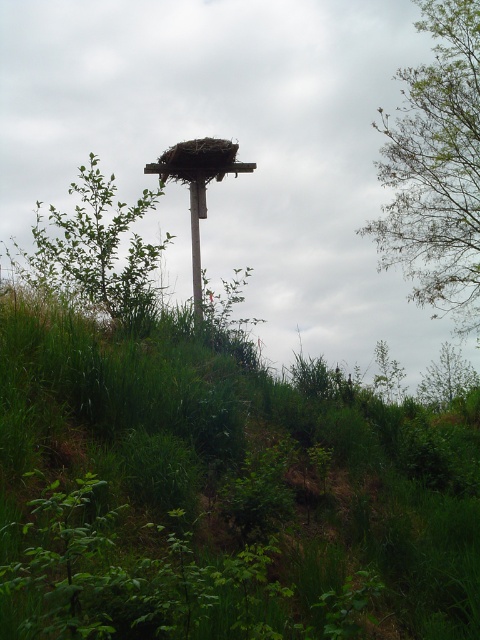
You are standing at the center of the image and want to place a small birdhouse exactly at the location of the green grass at center. According to the coordinates provided, what are the coordinates where you should place the birdhouse?

The coordinates for the green grass at center are at point (222,492), so you should place the birdhouse at those coordinates.

Based on the scene description, what is the color of the grass at the point labeled as point (222,492)?

The green grass at center is represented by point (222,492), so the color is green.

You are a bird looking for a nesting spot. You see the green leafy tree at upper right and the green leafy tree at center. Which tree is taller?

The green leafy tree at upper right is taller than the green leafy tree at center.